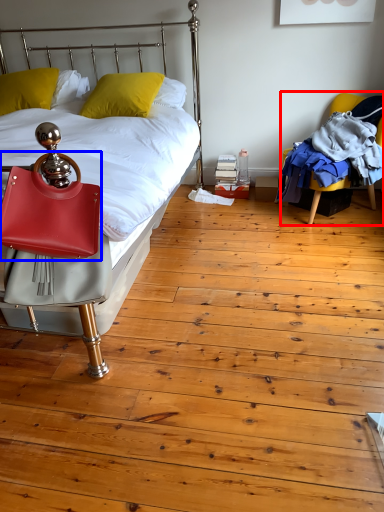
Question: Which of the following is the closest to the observer, chair (highlighted by a red box) or handbag (highlighted by a blue box)?

Choices:
 (A) chair
 (B) handbag

Answer: (B)